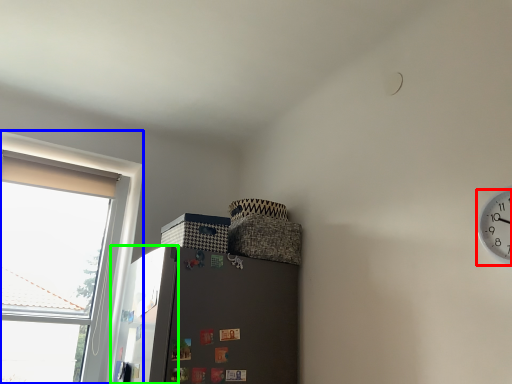
Question: Estimate the real-world distances between objects in this image. Which object is farther from clock (highlighted by a red box), window (highlighted by a blue box) or screen door (highlighted by a green box)?

Choices:
 (A) window
 (B) screen door

Answer: (A)